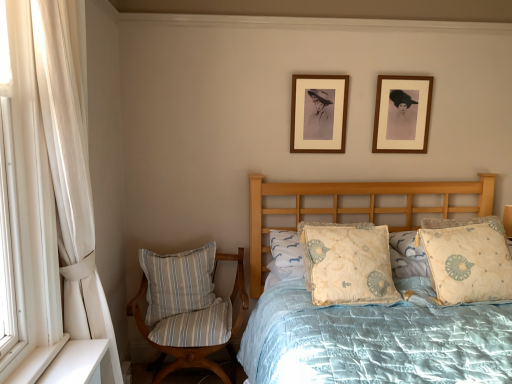
Question: Would you say white fabric curtain at left is to the left or to the right of light beige fabric pillow at center, acting as the 3th pillow starting from the left, in the picture?

Choices:
 (A) left
 (B) right

Answer: (A)

Question: Considering the positions of white fabric curtain at left and light beige fabric pillow at center, acting as the 3th pillow starting from the left, in the image, is white fabric curtain at left taller or shorter than light beige fabric pillow at center, acting as the 3th pillow starting from the left,?

Choices:
 (A) short
 (B) tall

Answer: (B)

Question: Which object is the farthest from the white fabric curtain at left?

Choices:
 (A) light blue quilted bed at center
 (B) beige floral pillow at right, positioned as the fourth pillow in left-to-right order
 (C) light beige fabric pillow at center, acting as the 3th pillow starting from the left
 (D) striped fabric pillow at lower left, which appears as the 4th pillow when viewed from the right
 (E) wooden picture frame at upper right, the second picture frame positioned from the left

Answer: (E)

Question: Estimate the real-world distances between objects in this image. Which object is closer to the light beige fabric pillow at center, the third pillow positioned from the right?

Choices:
 (A) light beige fabric pillow at center, which is the second pillow in right-to-left order
 (B) wooden picture frame at upper right, the second picture frame positioned from the left
 (C) white fabric curtain at left
 (D) striped fabric pillow at lower left, which is the 1th pillow in left-to-right order
 (E) light blue quilted bed at center

Answer: (A)